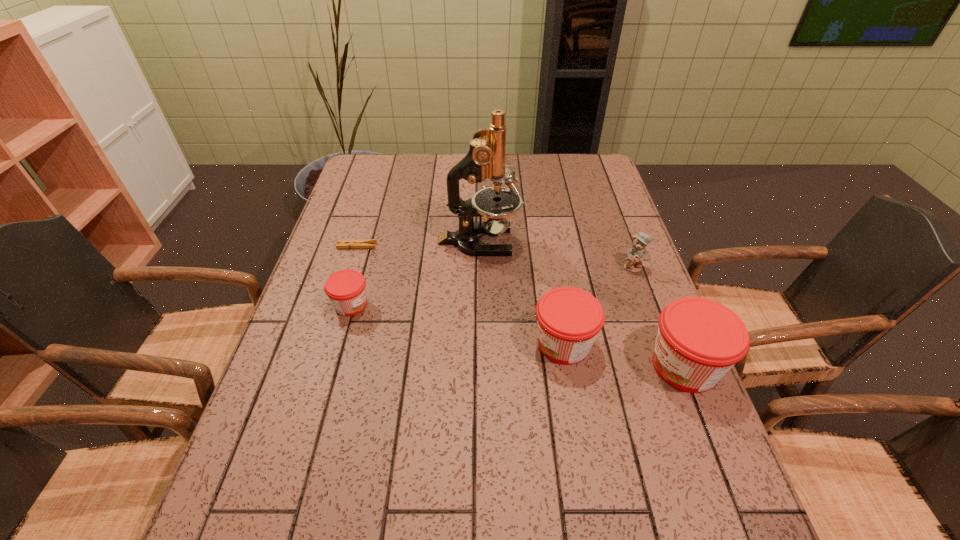
Find the location of a particular element. free space between the clothespin and the fourth object from right to left is located at coordinates (419, 244).

This screenshot has width=960, height=540. What are the coordinates of `vacant area that lies between the teddy bear and the clothespin` in the screenshot? It's located at (495, 256).

At what (x,y) coordinates should I click in order to perform the action: click on free space between the clothespin and the teddy bear. Please return your answer as a coordinate pair (x, y). The width and height of the screenshot is (960, 540). Looking at the image, I should click on (495, 256).

The height and width of the screenshot is (540, 960). Identify the location of free space between the clothespin and the third object from right to left. (461, 295).

Where is `vacant region between the third farthest object and the clothespin`? The image size is (960, 540). vacant region between the third farthest object and the clothespin is located at coordinates (495, 256).

The image size is (960, 540). What are the coordinates of `vacant area between the clothespin and the microscope` in the screenshot? It's located at (419, 244).

Identify which object is the third closest to the teddy bear. Please provide its 2D coordinates. Your answer should be formatted as a tuple, i.e. [(x, y)], where the tuple contains the x and y coordinates of a point satisfying the conditions above.

[(486, 158)]

Locate an element on the screen. The width and height of the screenshot is (960, 540). object that is the second closest to the third farthest object is located at coordinates (699, 340).

Point out which jam is positioned as the nearest to the teddy bear. Please provide its 2D coordinates. Your answer should be formatted as a tuple, i.e. [(x, y)], where the tuple contains the x and y coordinates of a point satisfying the conditions above.

[(569, 319)]

This screenshot has height=540, width=960. What are the coordinates of `jam that is the closest to the shortest jam` in the screenshot? It's located at (569, 319).